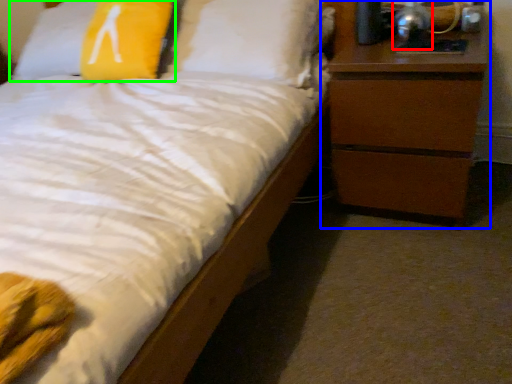
Question: Estimate the real-world distances between objects in this image. Which object is farther from bedside lamp (highlighted by a red box), chest of drawers (highlighted by a blue box) or pillow (highlighted by a green box)?

Choices:
 (A) chest of drawers
 (B) pillow

Answer: (B)